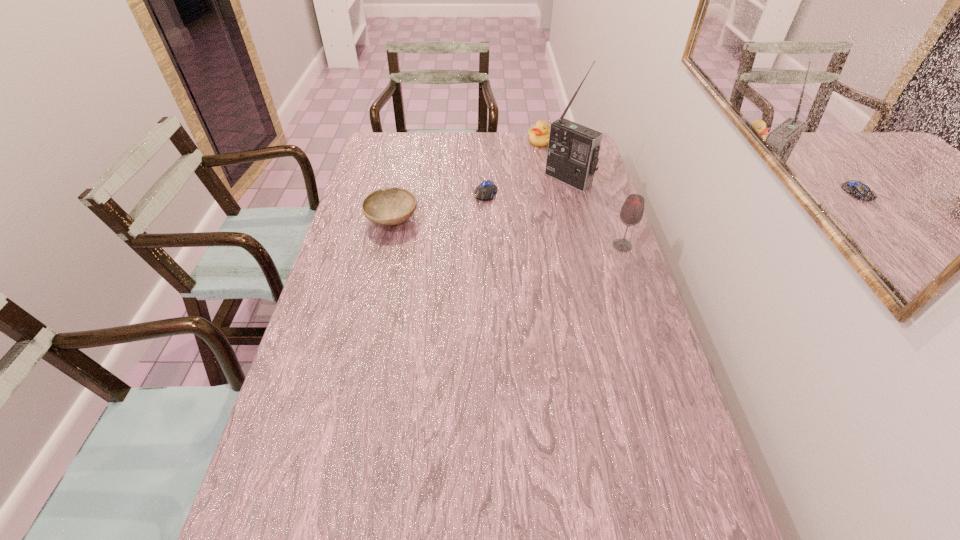
Locate an element on the screen. object that is at the far edge is located at coordinates (539, 135).

This screenshot has height=540, width=960. In order to click on object that is at the left edge in this screenshot , I will do `click(392, 206)`.

The image size is (960, 540). In order to click on glass drink container that is at the right edge in this screenshot , I will do `click(631, 213)`.

Identify the location of radio receiver at the right edge. (573, 149).

I want to click on duckling at the right edge, so click(x=539, y=135).

Locate an element on the screen. The height and width of the screenshot is (540, 960). object that is at the far right corner is located at coordinates (539, 135).

Image resolution: width=960 pixels, height=540 pixels. Identify the location of free location at the far edge. [x=469, y=138].

The image size is (960, 540). What are the coordinates of `free region at the near edge of the desktop` in the screenshot? It's located at (588, 514).

In the image, there is a desktop. Where is `vacant space at the left edge`? This screenshot has height=540, width=960. vacant space at the left edge is located at coordinates tap(333, 302).

Where is `vacant space at the right edge`? vacant space at the right edge is located at coordinates (656, 463).